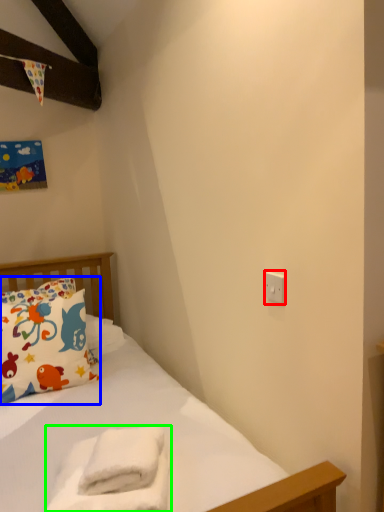
Question: Considering the real-world distances, which object is closest to electric outlet (highlighted by a red box)? pillow (highlighted by a blue box) or material (highlighted by a green box).

Choices:
 (A) pillow
 (B) material

Answer: (B)